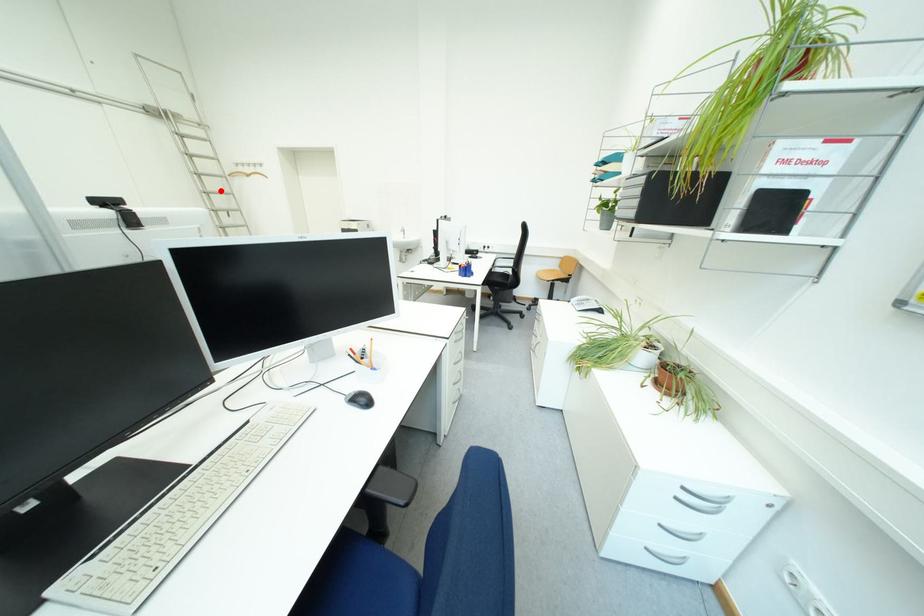
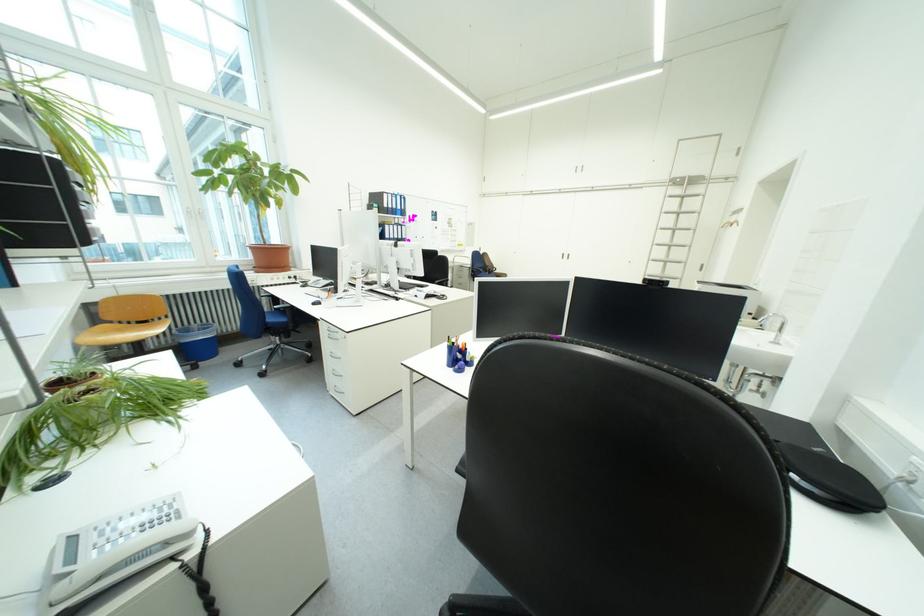
In the second image, find the point that corresponds to the highlighted location in the first image.

(687, 244)